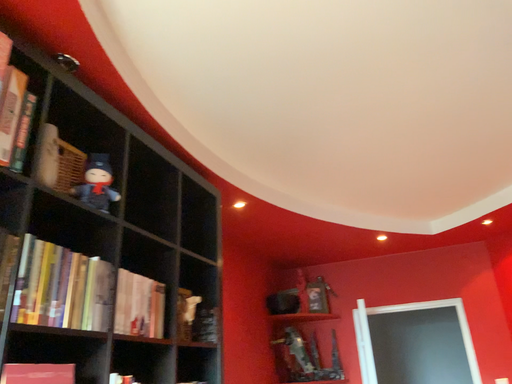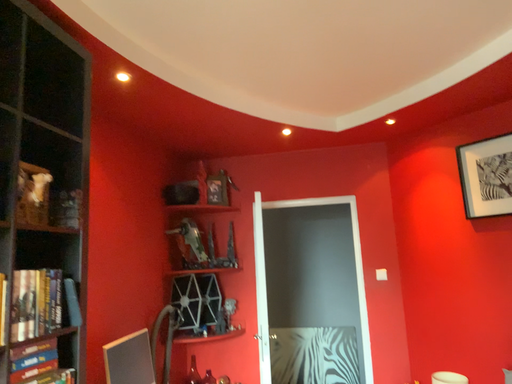
Question: How did the camera likely rotate when shooting the video?

Choices:
 (A) rotated left
 (B) rotated right

Answer: (B)